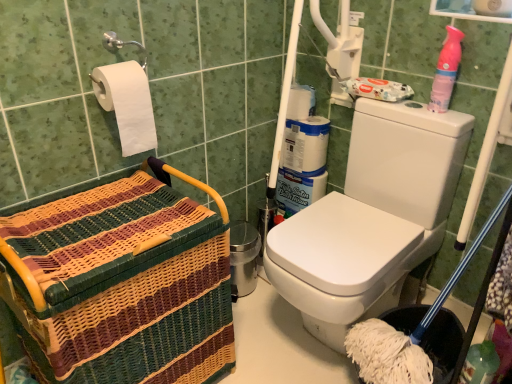
What is the approximate height of woven wood basket at left?

26.02 inches.

The height and width of the screenshot is (384, 512). What do you see at coordinates (446, 71) in the screenshot?
I see `pink plastic spray bottle at upper right` at bounding box center [446, 71].

Identify the location of pink plastic spray bottle at upper right. This screenshot has width=512, height=384. (446, 71).

What do you see at coordinates (127, 104) in the screenshot? I see `white matte toilet paper at upper left` at bounding box center [127, 104].

The width and height of the screenshot is (512, 384). What are the coordinates of `woven wood basket at left` in the screenshot? It's located at tap(121, 284).

Can you tell me how much woven wood basket at left and white matte toilet paper at upper left differ in facing direction?

0.256 degrees.

Consider the image. Is woven wood basket at left facing away from white matte toilet paper at upper left?

No, woven wood basket at left's orientation is not away from white matte toilet paper at upper left.

Who is taller, woven wood basket at left or white matte toilet paper at upper left?

With more height is woven wood basket at left.

The width and height of the screenshot is (512, 384). Find the location of `toilet paper above the woven wood basket at left (from a real-world perspective)`. toilet paper above the woven wood basket at left (from a real-world perspective) is located at coordinates (127, 104).

From a real-world perspective, between white matte toilet paper at upper left and woven wood basket at left, who is vertically lower?

woven wood basket at left, from a real-world perspective.

How many degrees apart are the facing directions of white matte toilet paper at upper left and woven wood basket at left?

They differ by 0.256 degrees in their facing directions.

Between white matte toilet paper at upper left and woven wood basket at left, which one has larger width?

woven wood basket at left.

From the image's perspective, who appears lower, white matte toilet paper at upper left or woven wood basket at left?

woven wood basket at left, from the image's perspective.

Measure the distance between pink plastic spray bottle at upper right and woven wood basket at left.

pink plastic spray bottle at upper right and woven wood basket at left are 98.32 centimeters apart.

Is pink plastic spray bottle at upper right facing towards woven wood basket at left?

No.

Is pink plastic spray bottle at upper right to the left of woven wood basket at left from the viewer's perspective?

In fact, pink plastic spray bottle at upper right is to the right of woven wood basket at left.

I want to click on basket on the left of pink plastic spray bottle at upper right, so click(x=121, y=284).

Between woven wood basket at left and pink plastic spray bottle at upper right, which one has less height?

Standing shorter between the two is pink plastic spray bottle at upper right.

Does point (95, 380) appear closer or farther from the camera than point (439, 78)?

Clearly, point (95, 380) is closer to the camera than point (439, 78).

Consider the image. Is white matte toilet paper at upper left looking in the opposite direction of pink plastic spray bottle at upper right?

No, white matte toilet paper at upper left is not facing away from pink plastic spray bottle at upper right.

Is point (155, 148) closer to camera compared to point (433, 96)?

No, (155, 148) is behind (433, 96).

Which is behind, white matte toilet paper at upper left or pink plastic spray bottle at upper right?

pink plastic spray bottle at upper right is further from the camera.

Between pink plastic spray bottle at upper right and white matte toilet paper at upper left, which one has smaller size?

pink plastic spray bottle at upper right.

Considering the relative positions of pink plastic spray bottle at upper right and white matte toilet paper at upper left in the image provided, is pink plastic spray bottle at upper right to the right of white matte toilet paper at upper left from the viewer's perspective?

Correct, you'll find pink plastic spray bottle at upper right to the right of white matte toilet paper at upper left.

Between pink plastic spray bottle at upper right and white matte toilet paper at upper left, which one has larger width?

Wider between the two is white matte toilet paper at upper left.

This screenshot has width=512, height=384. I want to click on toilet paper that is under the pink plastic spray bottle at upper right (from a real-world perspective), so click(127, 104).

Identify the location of toilet paper that appears above the woven wood basket at left (from the image's perspective). The height and width of the screenshot is (384, 512). (127, 104).

Locate an element on the screen. Image resolution: width=512 pixels, height=384 pixels. toilet paper behind the woven wood basket at left is located at coordinates (127, 104).

Based on their spatial positions, is white matte toilet paper at upper left or woven wood basket at left closer to pink plastic spray bottle at upper right?

Among the two, white matte toilet paper at upper left is located nearer to pink plastic spray bottle at upper right.

When comparing their distances from woven wood basket at left, does white matte toilet paper at upper left or pink plastic spray bottle at upper right seem further?

pink plastic spray bottle at upper right lies further to woven wood basket at left than the other object.

Considering their positions, is woven wood basket at left positioned further to pink plastic spray bottle at upper right than white matte toilet paper at upper left?

woven wood basket at left is positioned further to the anchor pink plastic spray bottle at upper right.

From the image, which object appears to be farther from white matte toilet paper at upper left, woven wood basket at left or pink plastic spray bottle at upper right?

Among the two, pink plastic spray bottle at upper right is located further to white matte toilet paper at upper left.

Considering their positions, is pink plastic spray bottle at upper right positioned closer to white matte toilet paper at upper left than woven wood basket at left?

The object closer to white matte toilet paper at upper left is woven wood basket at left.

Looking at this image, based on their spatial positions, is pink plastic spray bottle at upper right or white matte toilet paper at upper left further from woven wood basket at left?

The object further to woven wood basket at left is pink plastic spray bottle at upper right.

Image resolution: width=512 pixels, height=384 pixels. I want to click on basket between white matte toilet paper at upper left and pink plastic spray bottle at upper right, so click(121, 284).